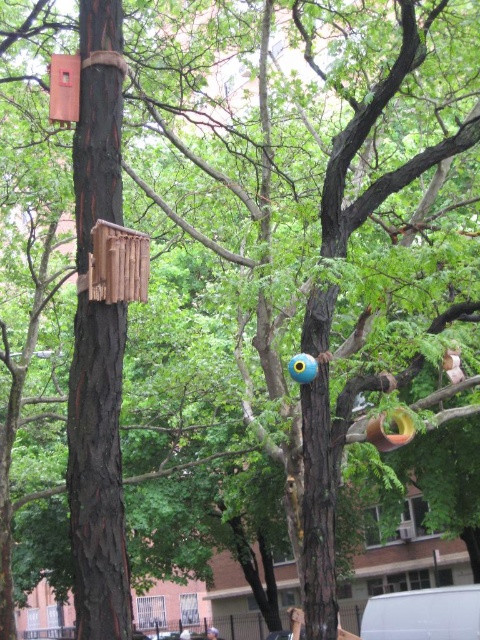
Question: Estimate the real-world distances between objects in this image. Which object is farther from the blue plastic ball at center?

Choices:
 (A) blue matte birdhouse at center
 (B) wooden bird feeder at left

Answer: (B)

Question: Does blue matte birdhouse at center have a greater width compared to blue plastic ball at center?

Choices:
 (A) no
 (B) yes

Answer: (A)

Question: Is blue matte birdhouse at center positioned in front of blue plastic ball at center?

Choices:
 (A) yes
 (B) no

Answer: (A)

Question: Is wooden bird feeder at left closer to camera compared to blue plastic ball at center?

Choices:
 (A) no
 (B) yes

Answer: (B)

Question: Which object appears closest to the camera in this image?

Choices:
 (A) wooden bird feeder at left
 (B) blue matte birdhouse at center
 (C) blue plastic ball at center

Answer: (A)

Question: Considering the real-world distances, which object is farthest from the wooden bird feeder at left?

Choices:
 (A) blue matte birdhouse at center
 (B) blue plastic ball at center

Answer: (B)